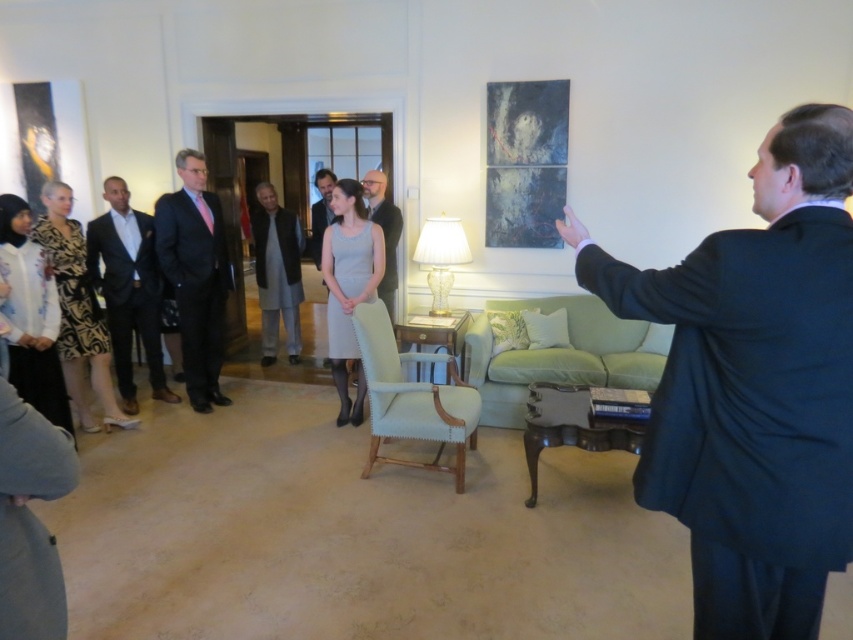
What is the position of the point with coordinates (77, 310) in the image?

The point with coordinates (77, 310) is located on the printed fabric dress at left.

You are a photographer at the event and need to capture a photo of both the gray fabric dress at center and the light brown leather jacket at center. Which one is located to the right of the other?

The gray fabric dress at center is positioned on the right side of light brown leather jacket at center, so the gray fabric dress at center is to the right of the light brown leather jacket at center.